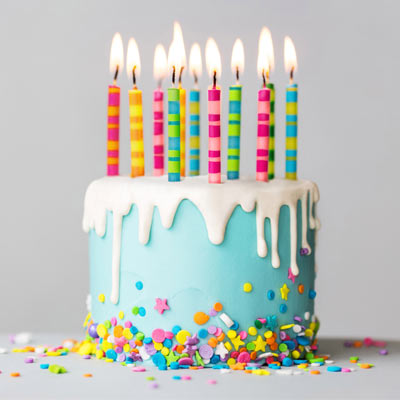
Identify the location of candles with pink. This screenshot has height=400, width=400. (110, 129), (154, 129), (215, 138), (265, 144).